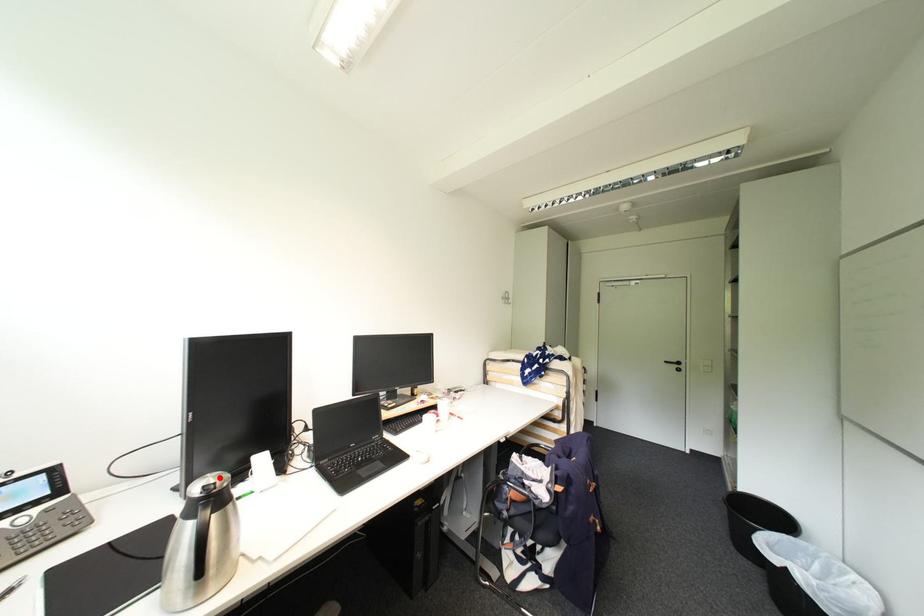
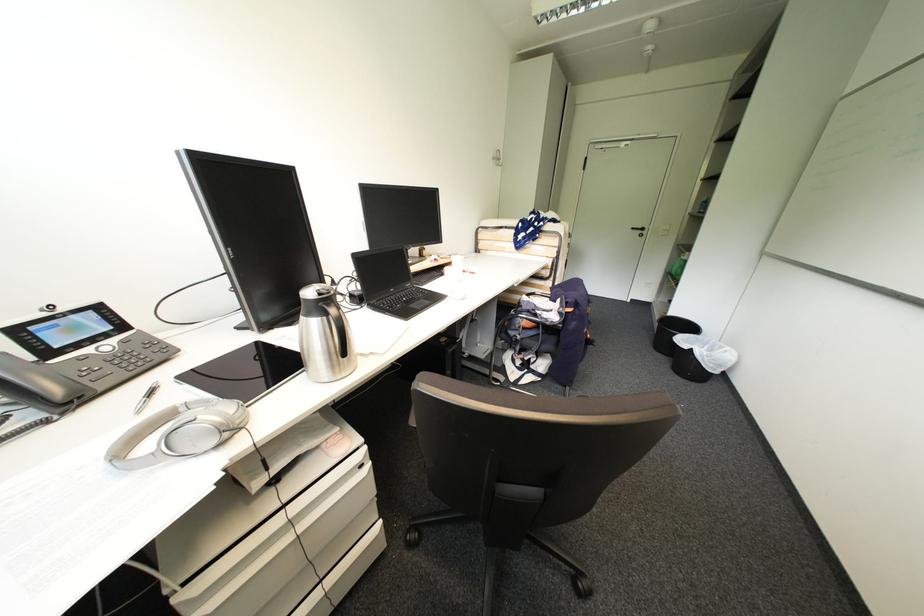
Question: I am providing you with two images of the same scene from different viewpoints. Given a red point in image1, look at the same physical point in image2. Is it:

Choices:
 (A) Closer to the viewpoint
 (B) Farther from the viewpoint

Answer: (A)